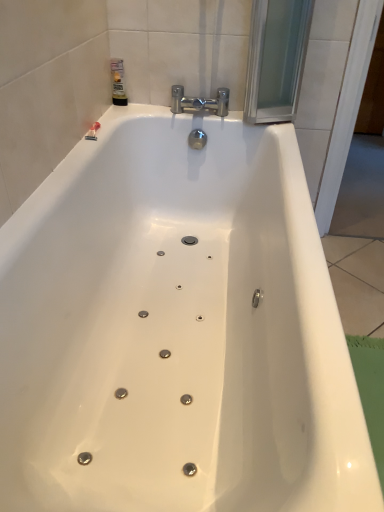
This screenshot has width=384, height=512. What do you see at coordinates (118, 88) in the screenshot?
I see `translucent plastic bottle at upper left` at bounding box center [118, 88].

Where is `translucent plastic bottle at upper left`? translucent plastic bottle at upper left is located at coordinates (118, 88).

What is the approximate width of translucent plastic bottle at upper left?

translucent plastic bottle at upper left is 2.68 inches wide.

The height and width of the screenshot is (512, 384). In order to click on chrome/metallic faucet at upper center in this screenshot , I will do `click(200, 101)`.

What is the approximate height of chrome/metallic faucet at upper center?

4.46 inches.

The width and height of the screenshot is (384, 512). What do you see at coordinates (200, 101) in the screenshot?
I see `chrome/metallic faucet at upper center` at bounding box center [200, 101].

Where is `translucent plastic bottle at upper left`? translucent plastic bottle at upper left is located at coordinates (118, 88).

Would you say translucent plastic bottle at upper left is to the left or to the right of chrome/metallic faucet at upper center in the picture?

translucent plastic bottle at upper left is positioned on chrome/metallic faucet at upper center's left side.

In the image, is translucent plastic bottle at upper left positioned in front of or behind chrome/metallic faucet at upper center?

translucent plastic bottle at upper left is positioned farther from the viewer than chrome/metallic faucet at upper center.

Which point is more distant from viewer, (120, 83) or (179, 103)?

Point (179, 103)

From the image's perspective, does translucent plastic bottle at upper left appear higher than chrome/metallic faucet at upper center?

Yes.

From a real-world perspective, relative to chrome/metallic faucet at upper center, is translucent plastic bottle at upper left vertically above or below?

translucent plastic bottle at upper left is situated higher than chrome/metallic faucet at upper center in the real world.

Between translucent plastic bottle at upper left and chrome/metallic faucet at upper center, which one has smaller width?

Thinner between the two is translucent plastic bottle at upper left.

Looking at this image, who is shorter, translucent plastic bottle at upper left or chrome/metallic faucet at upper center?

Standing shorter between the two is chrome/metallic faucet at upper center.

Considering the sizes of translucent plastic bottle at upper left and chrome/metallic faucet at upper center in the image, is translucent plastic bottle at upper left bigger or smaller than chrome/metallic faucet at upper center?

In the image, translucent plastic bottle at upper left appears to be smaller than chrome/metallic faucet at upper center.

Is translucent plastic bottle at upper left located outside chrome/metallic faucet at upper center?

Yes, translucent plastic bottle at upper left is located beyond the bounds of chrome/metallic faucet at upper center.

Is translucent plastic bottle at upper left directly adjacent to chrome/metallic faucet at upper center?

No, translucent plastic bottle at upper left is not touching chrome/metallic faucet at upper center.

In the scene shown: Is translucent plastic bottle at upper left facing towards chrome/metallic faucet at upper center?

Yes, translucent plastic bottle at upper left is oriented towards chrome/metallic faucet at upper center.

What's the angular difference between translucent plastic bottle at upper left and chrome/metallic faucet at upper center's facing directions?

translucent plastic bottle at upper left and chrome/metallic faucet at upper center are facing 91.6 degrees away from each other.

Where is `tap that appears below the translucent plastic bottle at upper left (from a real-world perspective)`? This screenshot has width=384, height=512. tap that appears below the translucent plastic bottle at upper left (from a real-world perspective) is located at coordinates (200, 101).

Visually, is chrome/metallic faucet at upper center positioned to the left or to the right of translucent plastic bottle at upper left?

chrome/metallic faucet at upper center is positioned on translucent plastic bottle at upper left's right side.

From the picture: Relative to translucent plastic bottle at upper left, is chrome/metallic faucet at upper center in front or behind?

chrome/metallic faucet at upper center is positioned closer to the viewer than translucent plastic bottle at upper left.

Which is behind, point (192, 100) or point (125, 95)?

The point (125, 95) is behind.

From the image's perspective, which object appears higher, chrome/metallic faucet at upper center or translucent plastic bottle at upper left?

translucent plastic bottle at upper left, from the image's perspective.

From a real-world perspective, which object stands above the other?

From a 3D spatial view, translucent plastic bottle at upper left is above.

Which object is wider, chrome/metallic faucet at upper center or translucent plastic bottle at upper left?

chrome/metallic faucet at upper center is wider.

Does chrome/metallic faucet at upper center have a greater height compared to translucent plastic bottle at upper left?

No.

Considering the relative sizes of chrome/metallic faucet at upper center and translucent plastic bottle at upper left in the image provided, is chrome/metallic faucet at upper center smaller than translucent plastic bottle at upper left?

No.

In the scene shown: Would you say chrome/metallic faucet at upper center is inside or outside translucent plastic bottle at upper left?

The correct answer is: outside.

Is there a large distance between chrome/metallic faucet at upper center and translucent plastic bottle at upper left?

No, chrome/metallic faucet at upper center is not far from translucent plastic bottle at upper left.

Is chrome/metallic faucet at upper center oriented towards translucent plastic bottle at upper left?

No, chrome/metallic faucet at upper center is not turned towards translucent plastic bottle at upper left.

Looking at this image, how different are the orientations of chrome/metallic faucet at upper center and translucent plastic bottle at upper left in degrees?

The facing directions of chrome/metallic faucet at upper center and translucent plastic bottle at upper left are 91.6 degrees apart.

This screenshot has height=512, width=384. Find the location of `toiletry behind the chrome/metallic faucet at upper center`. toiletry behind the chrome/metallic faucet at upper center is located at coordinates (118, 88).

Find the location of `tap located underneath the translucent plastic bottle at upper left (from a real-world perspective)`. tap located underneath the translucent plastic bottle at upper left (from a real-world perspective) is located at coordinates (200, 101).

Identify the location of tap located on the right of translucent plastic bottle at upper left. Image resolution: width=384 pixels, height=512 pixels. (200, 101).